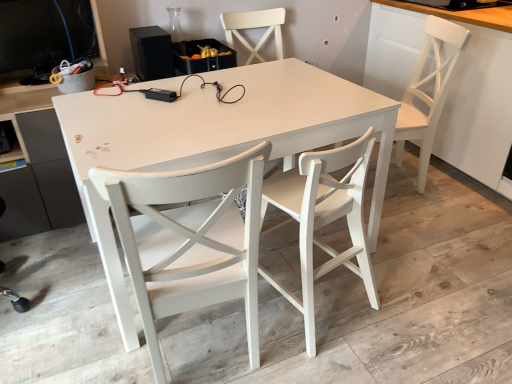
This screenshot has height=384, width=512. I want to click on free location to the right of white wood chair at center, the second chair positioned from the right, so (x=412, y=294).